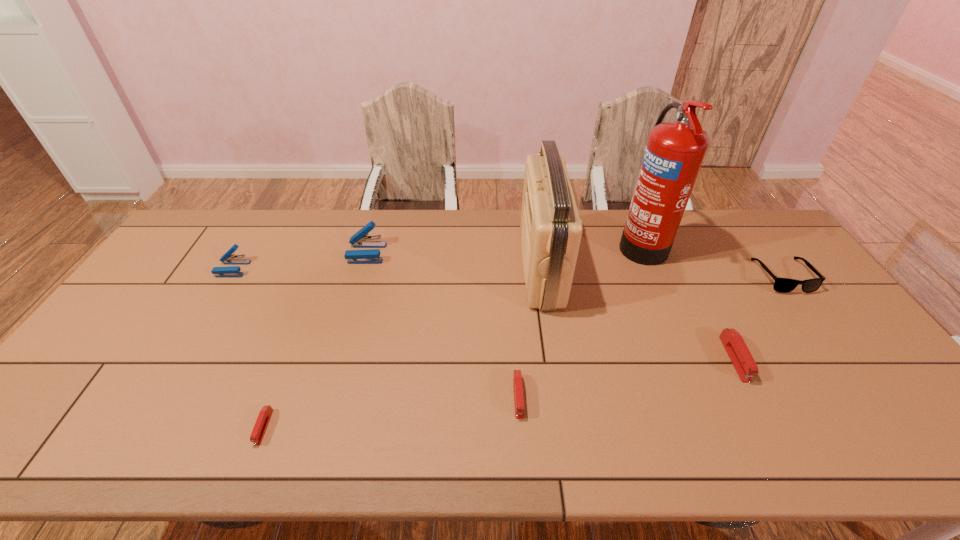
Where is `the tallest object`? the tallest object is located at coordinates (674, 152).

At what (x,y) coordinates should I click in order to perform the action: click on red fire extinguisher. Please return your answer as a coordinate pair (x, y). The image size is (960, 540). Looking at the image, I should click on (674, 152).

You are a GUI agent. You are given a task and a screenshot of the screen. Output one action in this format:
    pyautogui.click(x=<x>, y=<y>)
    Task: Click on the beige radio receiver
    
    Given the screenshot: What is the action you would take?
    pos(551,229)

Find the location of a particular element. the fourth object from right to left is located at coordinates (551, 229).

I want to click on the tallest stapler, so tap(360, 239).

Find the location of a particular element. The width and height of the screenshot is (960, 540). the third tallest object is located at coordinates (360, 239).

Find the location of `the second tallest stapler`. the second tallest stapler is located at coordinates (232, 271).

At what (x,y) coordinates should I click in order to perform the action: click on the leftmost stapler. Please return your answer as a coordinate pair (x, y). This screenshot has height=540, width=960. Looking at the image, I should click on (232, 271).

Locate an element on the screen. The image size is (960, 540). sunglasses is located at coordinates (783, 285).

This screenshot has width=960, height=540. I want to click on the biggest red stapler, so click(737, 350).